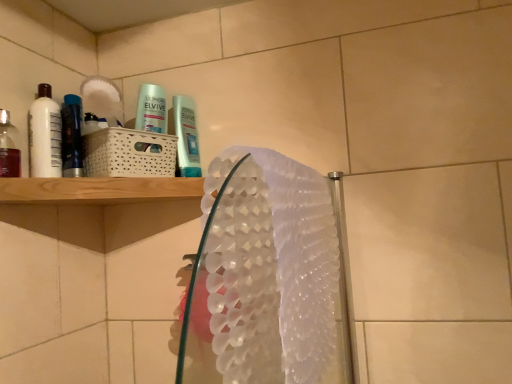
Question: Is the depth of white textured hand towel at center greater than that of translucent plastic mouthwash at left, which is counted as the 1th mouthwash, starting from the front?

Choices:
 (A) no
 (B) yes

Answer: (A)

Question: Is white textured hand towel at center shorter than translucent plastic mouthwash at left, which appears as the third mouthwash when viewed from the back?

Choices:
 (A) no
 (B) yes

Answer: (A)

Question: Can you confirm if white textured hand towel at center is positioned to the left of translucent plastic mouthwash at left, which is counted as the 1th mouthwash, starting from the front?

Choices:
 (A) yes
 (B) no

Answer: (B)

Question: Is white textured hand towel at center next to translucent plastic mouthwash at left, which is counted as the 1th mouthwash, starting from the front, and touching it?

Choices:
 (A) yes
 (B) no

Answer: (B)

Question: Can we say white textured hand towel at center lies outside translucent plastic mouthwash at left, which appears as the third mouthwash when viewed from the back?

Choices:
 (A) yes
 (B) no

Answer: (A)

Question: Looking at the image, does white glossy mouthwash at left, the second mouthwash from the back, seem bigger or smaller compared to metallic blue mouthwash at left, which is the first mouthwash from back to front?

Choices:
 (A) big
 (B) small

Answer: (B)

Question: Visually, is white glossy mouthwash at left, the second mouthwash from the front, positioned to the left or to the right of metallic blue mouthwash at left, which is the first mouthwash from back to front?

Choices:
 (A) left
 (B) right

Answer: (A)

Question: Does point (51, 144) appear closer or farther from the camera than point (80, 172)?

Choices:
 (A) farther
 (B) closer

Answer: (B)

Question: From a real-world perspective, is white glossy mouthwash at left, the second mouthwash from the back, physically located above or below metallic blue mouthwash at left, acting as the third mouthwash starting from the front?

Choices:
 (A) above
 (B) below

Answer: (A)

Question: Based on their positions, is white textured hand towel at center located to the left or right of translucent plastic mouthwash at left, which is counted as the 1th mouthwash, starting from the front?

Choices:
 (A) left
 (B) right

Answer: (B)

Question: Considering the positions of point (x=224, y=215) and point (x=4, y=140), is point (x=224, y=215) closer or farther from the camera than point (x=4, y=140)?

Choices:
 (A) closer
 (B) farther

Answer: (A)

Question: Considering the positions of white textured hand towel at center and translucent plastic mouthwash at left, which is counted as the 1th mouthwash, starting from the front, in the image, is white textured hand towel at center taller or shorter than translucent plastic mouthwash at left, which is counted as the 1th mouthwash, starting from the front,?

Choices:
 (A) tall
 (B) short

Answer: (A)

Question: In terms of width, does white textured hand towel at center look wider or thinner when compared to translucent plastic mouthwash at left, which is counted as the 1th mouthwash, starting from the front?

Choices:
 (A) wide
 (B) thin

Answer: (A)

Question: Visually, is metallic blue mouthwash at left, acting as the third mouthwash starting from the front, positioned to the left or to the right of translucent plastic mouthwash at left, which appears as the third mouthwash when viewed from the back?

Choices:
 (A) right
 (B) left

Answer: (A)

Question: In terms of width, does metallic blue mouthwash at left, which is the first mouthwash from back to front, look wider or thinner when compared to translucent plastic mouthwash at left, which is counted as the 1th mouthwash, starting from the front?

Choices:
 (A) wide
 (B) thin

Answer: (A)